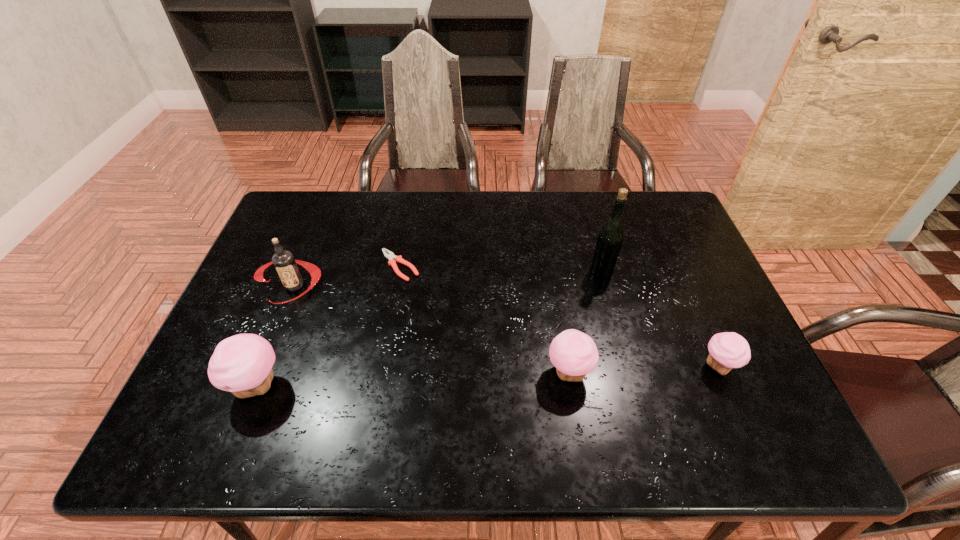
If we want them evenly spaced by inserting an extra cupcake among them, please locate a free spot for this new cupcake. Please provide its 2D coordinates. Your answer should be formatted as a tuple, i.e. [(x, y)], where the tuple contains the x and y coordinates of a point satisfying the conditions above.

[(415, 379)]